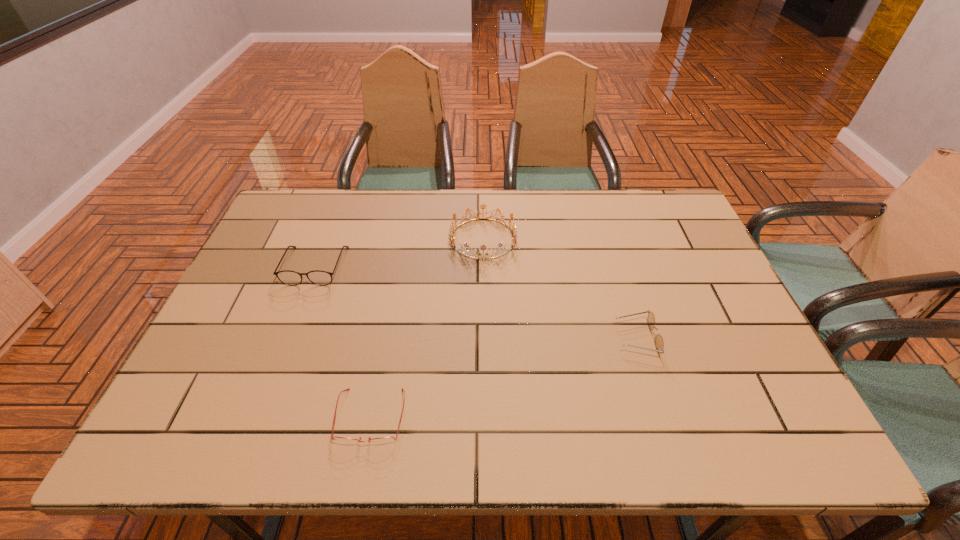
Where is `vacant space at the far left corner`? vacant space at the far left corner is located at coordinates (280, 220).

You are a GUI agent. You are given a task and a screenshot of the screen. Output one action in this format:
    pyautogui.click(x=<x>, y=<y>)
    Task: Click on the vacant space at the far right corner of the desktop
    
    Given the screenshot: What is the action you would take?
    pyautogui.click(x=670, y=205)

In the image, there is a desktop. Where is `vacant area at the near right corner`? The image size is (960, 540). vacant area at the near right corner is located at coordinates (738, 442).

At what (x,y) coordinates should I click in order to perform the action: click on free space between the rightmost spectacles and the nearest object. Please return your answer as a coordinate pair (x, y). Image resolution: width=960 pixels, height=540 pixels. Looking at the image, I should click on (504, 377).

Where is `empty space between the tiara and the second shortest spectacles`? The image size is (960, 540). empty space between the tiara and the second shortest spectacles is located at coordinates (560, 288).

Locate an element on the screen. The width and height of the screenshot is (960, 540). unoccupied position between the rightmost object and the second object from right to left is located at coordinates (560, 288).

Locate an element on the screen. This screenshot has width=960, height=540. vacant space that's between the second object from left to right and the rightmost object is located at coordinates (504, 377).

Where is `free space that is in between the farthest spectacles and the second object from right to left`? free space that is in between the farthest spectacles and the second object from right to left is located at coordinates (399, 252).

Where is `free space between the tallest object and the tallest spectacles`? The width and height of the screenshot is (960, 540). free space between the tallest object and the tallest spectacles is located at coordinates (399, 252).

This screenshot has width=960, height=540. In order to click on empty location between the leftmost spectacles and the rightmost object in this screenshot , I will do `click(476, 302)`.